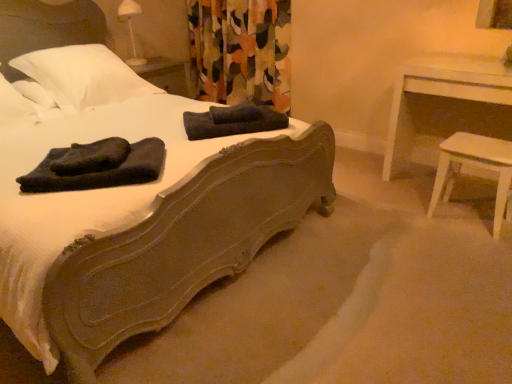
Where is `free space above dark blue fleece bath towel at center, the 3th bath towel viewed from the back (from a real-world perspective)`? free space above dark blue fleece bath towel at center, the 3th bath towel viewed from the back (from a real-world perspective) is located at coordinates (101, 155).